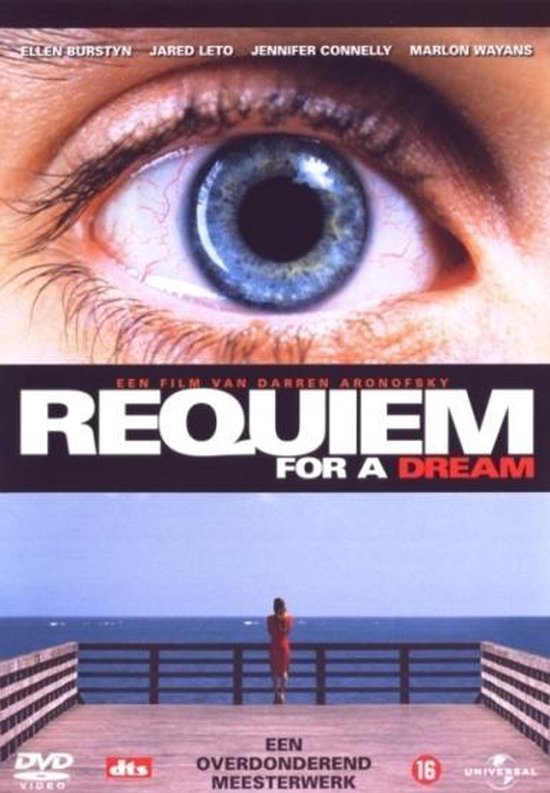
Find the location of `globe`. globe is located at coordinates (500, 763).